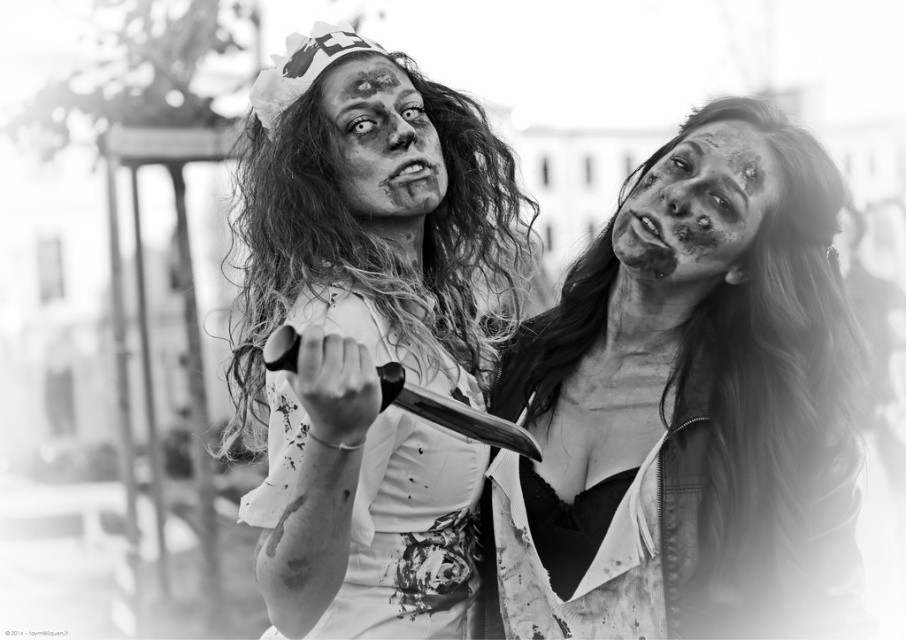
Question: Which object appears closest to the camera in this image?

Choices:
 (A) white textured dress at center
 (B) matte white face at center

Answer: (A)

Question: Estimate the real-world distances between objects in this image. Which object is closer to the matte white dress at center?

Choices:
 (A) matte skin face at right
 (B) matte white jacket at center
 (C) matte white face at center

Answer: (C)

Question: Can you confirm if white textured dress at center is smaller than matte white face at center?

Choices:
 (A) yes
 (B) no

Answer: (B)

Question: From the image, what is the correct spatial relationship of matte white jacket at center in relation to matte white dress at center?

Choices:
 (A) below
 (B) above

Answer: (A)

Question: Which of the following is the closest to the observer?

Choices:
 (A) white textured dress at center
 (B) matte white jacket at center
 (C) matte white face at center

Answer: (A)

Question: Where is matte white jacket at center located in relation to matte skin face at right in the image?

Choices:
 (A) above
 (B) below

Answer: (B)